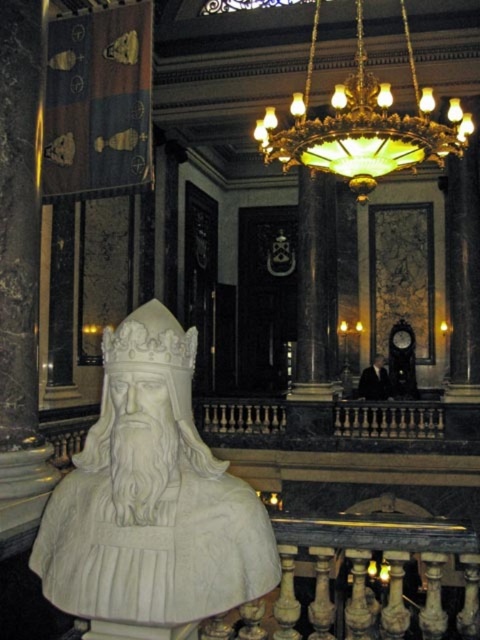
You are standing in the grand interior space and want to locate the white marble bust at center. According to the coordinates provided, where should you look to find it?

The white marble bust at center is located at coordinates point (152, 497).

You are an interior designer planning to place a new decorative item between the white marble bust at center and the green stained glass chandelier at upper center. Considering their sizes, which object should the new item be placed closer to?

The new item should be placed closer to the white marble bust at center because its width is smaller than the green stained glass chandelier at upper center, allowing more space between them.

You are an interior designer planning to place a new decorative item in the room. The white marble bust at center is currently at point (152, 497). If you want to place the new item 2 meters to the right of the white marble bust at center, where would its coordinates be?

The new item would be placed at coordinates calculated by adding 2 meters to the x coordinate of the white marble bust at center. However, without knowing the scale of the coordinate system, it is impossible to determine the exact coordinates.